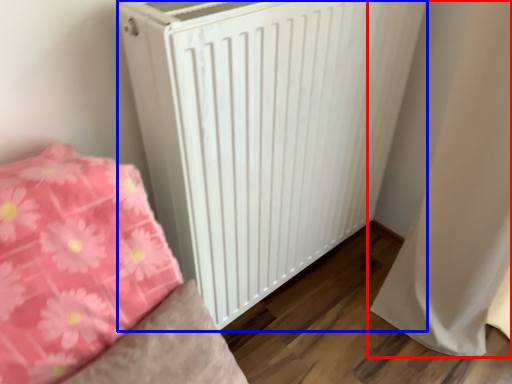
Question: Which of the following is the farthest to the observer, curtain (highlighted by a red box) or radiator (highlighted by a blue box)?

Choices:
 (A) curtain
 (B) radiator

Answer: (A)